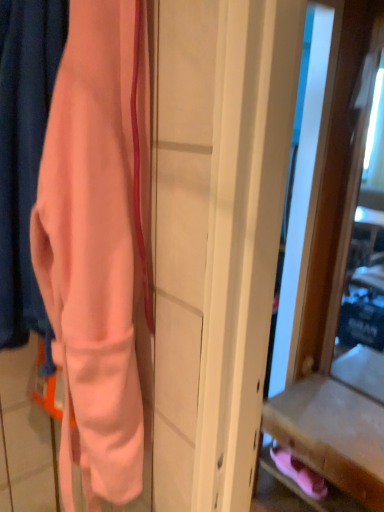
Question: Is wooden drawer at lower right at the left side of pink suede shoes at lower right?

Choices:
 (A) no
 (B) yes

Answer: (A)

Question: Is wooden drawer at lower right to the right of pink suede shoes at lower right from the viewer's perspective?

Choices:
 (A) no
 (B) yes

Answer: (B)

Question: Does wooden drawer at lower right lie in front of pink suede shoes at lower right?

Choices:
 (A) no
 (B) yes

Answer: (B)

Question: From a real-world perspective, is wooden drawer at lower right below pink suede shoes at lower right?

Choices:
 (A) no
 (B) yes

Answer: (B)

Question: Can you confirm if wooden drawer at lower right is thinner than pink suede shoes at lower right?

Choices:
 (A) no
 (B) yes

Answer: (A)

Question: Is wooden drawer at lower right not within pink suede shoes at lower right?

Choices:
 (A) yes
 (B) no

Answer: (A)

Question: Can you confirm if pink suede shoes at lower right is taller than wooden drawer at lower right?

Choices:
 (A) yes
 (B) no

Answer: (B)

Question: Does pink suede shoes at lower right appear on the left side of wooden drawer at lower right?

Choices:
 (A) yes
 (B) no

Answer: (A)

Question: From the image's perspective, does pink suede shoes at lower right appear lower than wooden drawer at lower right?

Choices:
 (A) yes
 (B) no

Answer: (B)

Question: Can you confirm if pink suede shoes at lower right is bigger than wooden drawer at lower right?

Choices:
 (A) yes
 (B) no

Answer: (B)

Question: Is pink suede shoes at lower right turned away from wooden drawer at lower right?

Choices:
 (A) yes
 (B) no

Answer: (A)

Question: Can you confirm if pink suede shoes at lower right is thinner than wooden drawer at lower right?

Choices:
 (A) yes
 (B) no

Answer: (A)

Question: Is pink suede shoes at lower right a part of matte peach fabric at left?

Choices:
 (A) no
 (B) yes

Answer: (A)